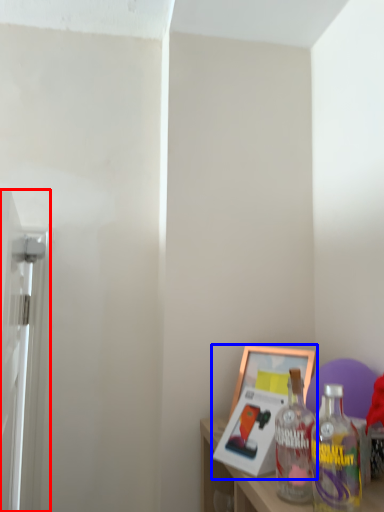
Question: Which object is closer to the camera taking this photo, screen door (highlighted by a red box) or picture frame (highlighted by a blue box)?

Choices:
 (A) screen door
 (B) picture frame

Answer: (A)